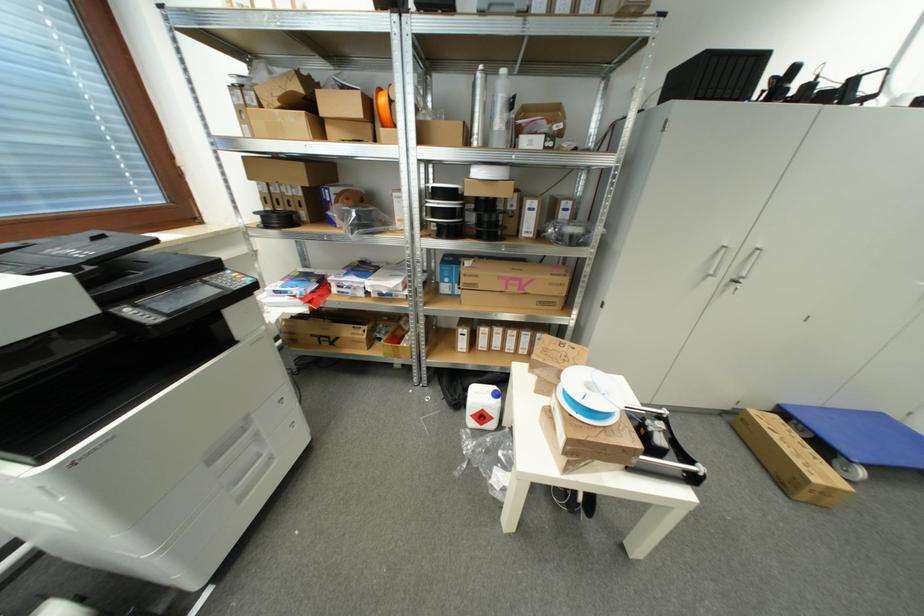
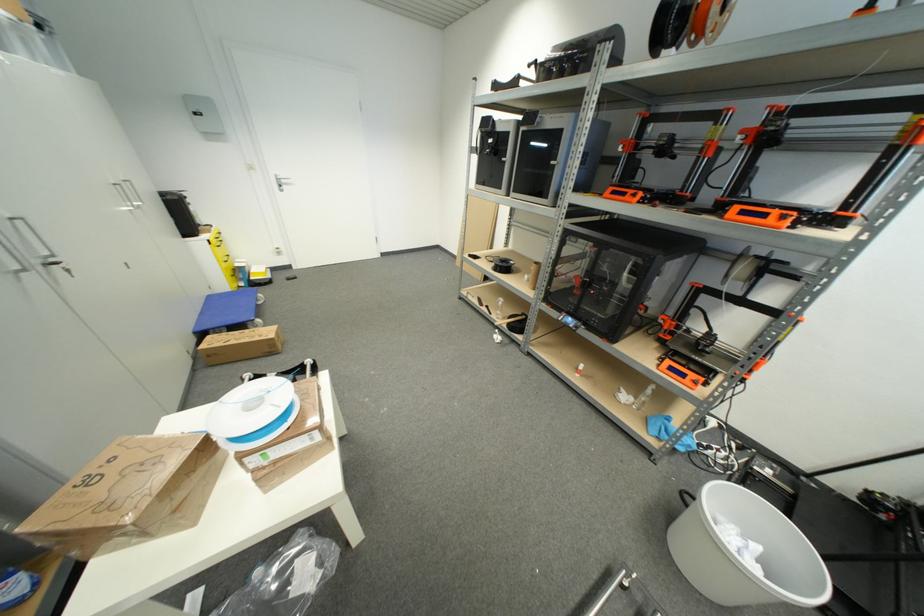
Where in the second image is the point corresponding to pixel 885 418 from the first image?

(213, 299)